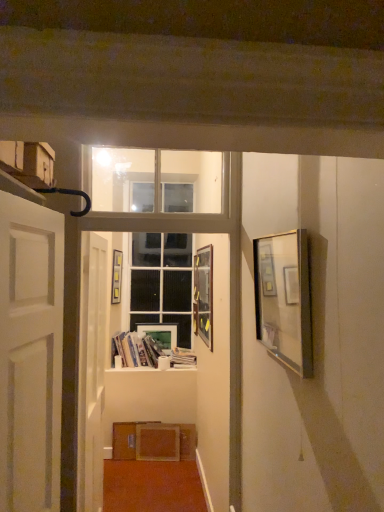
Question: From the image's perspective, is white glass door at center positioned above or below white glossy door at center, the first door when ordered from back to front?

Choices:
 (A) above
 (B) below

Answer: (A)

Question: Is white glass door at center situated inside white glossy door at center, the first door when ordered from back to front, or outside?

Choices:
 (A) inside
 (B) outside

Answer: (B)

Question: Estimate the real-world distances between objects in this image. Which object is farther from the matte white picture frame at center, positioned as the fourth picture frame in front-to-back order?

Choices:
 (A) hardcover books at center, the 2th book when ordered from right to left
 (B) hardcover book at center, the first book in the right-to-left sequence
 (C) wooden picture frame at center, the fourth picture frame from the right
 (D) metallic silver picture frame at right, the fourth picture frame in the left-to-right sequence
 (E) white matte door at left, which appears as the 1th door when viewed from the front

Answer: (D)

Question: Which object is positioned closest to the metallic silver picture frame at center, the second picture frame in the right-to-left sequence?

Choices:
 (A) hardcover books at center, the 2th book when ordered from right to left
 (B) matte cardboard box at upper left
 (C) clear glass window frame at upper center
 (D) metallic silver picture frame at right, which is the first picture frame in right-to-left order
 (E) white glass door at center

Answer: (C)